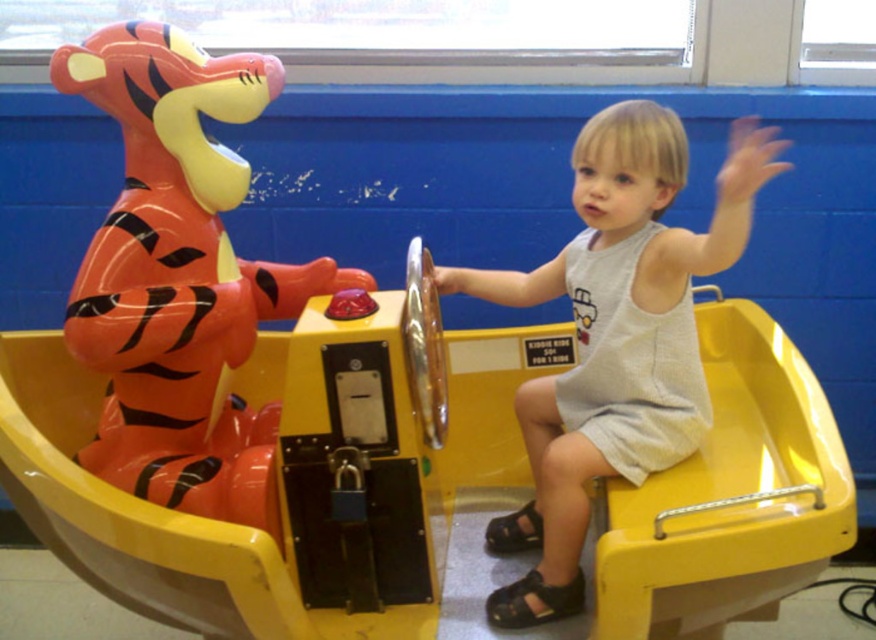
You are standing at point [97,36] and want to walk to point [730,220]. Which direction should you move?

You should move forward because point [97,36] is behind point [730,220].

Consider the image. You are a safety inspector checking the layout of this play area. The rubberized orange tiger at left and the white cotton dress at center are both part of the safety equipment. According to the safety guidelines, the dress must be placed in front of the tiger to ensure visibility. Is the current arrangement compliant with the guidelines?

The white cotton dress at center is behind the rubberized orange tiger at left, so the current arrangement is not compliant with the safety guidelines because the dress should be placed in front of the tiger for visibility.